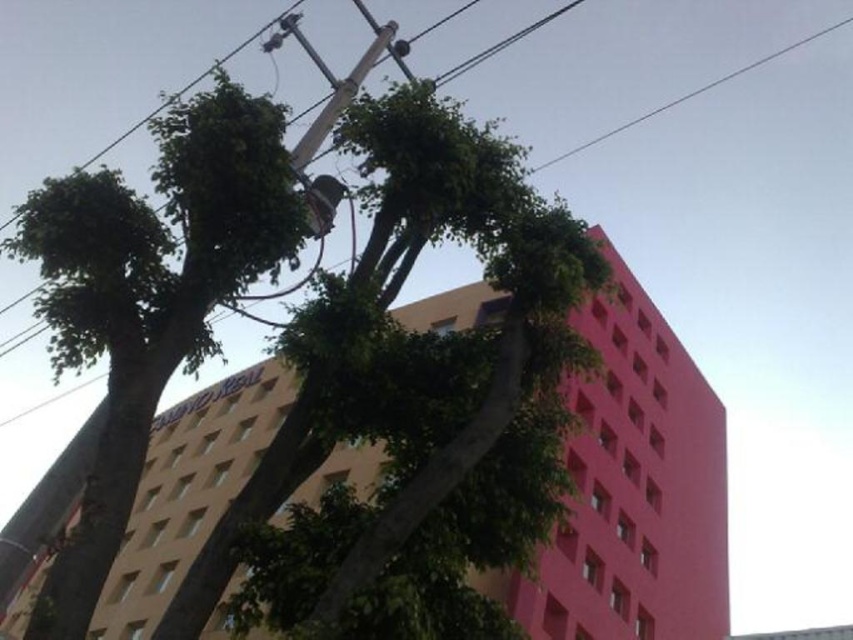
Find the location of a particular element. pink matte building at center is located at coordinates (633, 490).

Can you confirm if pink matte building at center is shorter than metallic gray power line at upper center?

Yes.

Between point (631, 563) and point (22, 332), which one is positioned behind?

The point (22, 332) is behind.

This screenshot has height=640, width=853. In order to click on pink matte building at center in this screenshot , I will do `click(633, 490)`.

Is point (281, 132) more distant than point (27, 332)?

No, (281, 132) is in front of (27, 332).

Between green leafy tree at upper left and metallic gray power line at upper center, which one appears on the right side from the viewer's perspective?

From the viewer's perspective, metallic gray power line at upper center appears more on the right side.

Locate an element on the screen. Image resolution: width=853 pixels, height=640 pixels. green leafy tree at upper left is located at coordinates point(151,296).

Between pink matte building at center and green leafy tree at upper left, which one is positioned higher?

green leafy tree at upper left is above.

Can you confirm if pink matte building at center is positioned above green leafy tree at upper left?

No, pink matte building at center is not above green leafy tree at upper left.

Where is `pink matte building at center`? pink matte building at center is located at coordinates (633, 490).

At what (x,y) coordinates should I click in order to perform the action: click on pink matte building at center. Please return your answer as a coordinate pair (x, y). This screenshot has height=640, width=853. Looking at the image, I should click on (633, 490).